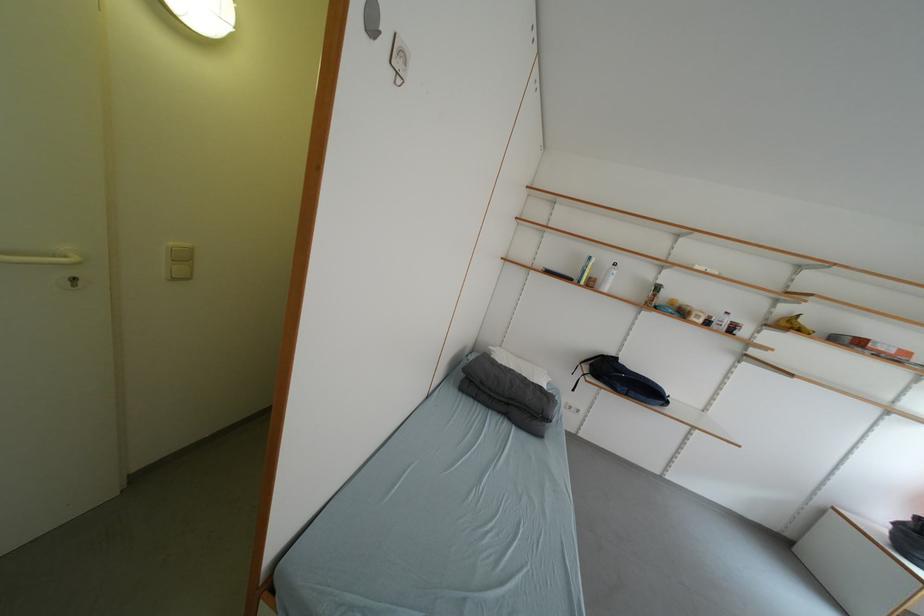
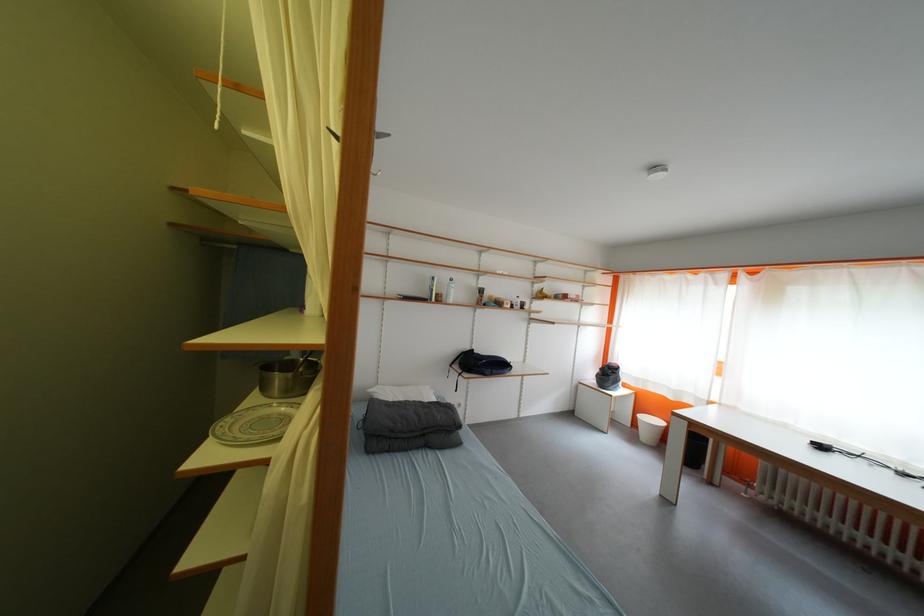
Locate, in the second image, the point that corresponds to pixel 600 286 in the first image.

(447, 302)